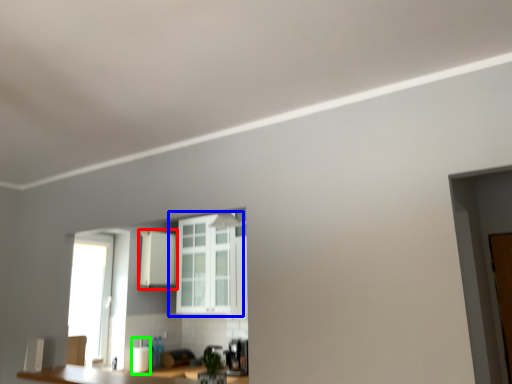
Question: Considering the real-world distances, which object is closest to cabinetry (highlighted by a red box)? window (highlighted by a blue box) or appliance (highlighted by a green box).

Choices:
 (A) window
 (B) appliance

Answer: (A)